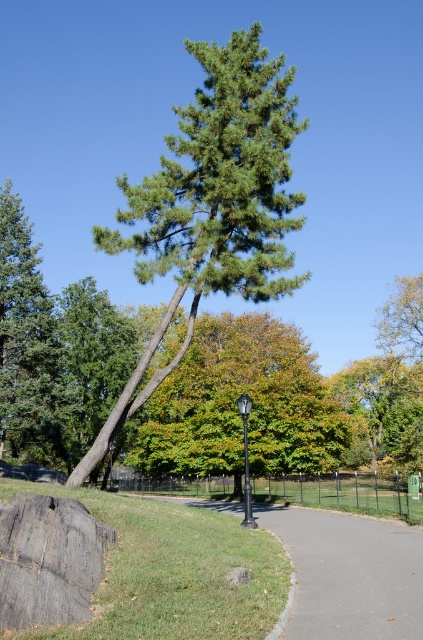
Is green needle-like tree at upper left further to the viewer compared to gray rough rock at lower left?

Yes, green needle-like tree at upper left is further from the viewer.

Does green needle-like tree at upper left have a greater width compared to gray rough rock at lower left?

Yes, green needle-like tree at upper left is wider than gray rough rock at lower left.

Which is behind, point (52, 312) or point (14, 586)?

The point (52, 312) is more distant.

Locate an element on the screen. The image size is (423, 640). green needle-like tree at upper left is located at coordinates (30, 346).

Who is taller, green needle-like at center or gray rough rock at lower left?

With more height is green needle-like at center.

Is green needle-like at center taller than gray rough rock at lower left?

Correct, green needle-like at center is much taller as gray rough rock at lower left.

Who is more forward, (167, 248) or (84, 588)?

Point (84, 588) is in front.

Identify the location of green needle-like at center. The height and width of the screenshot is (640, 423). tap(211, 202).

From the picture: Between green leafy tree at center and green needle-like tree at upper left, which one is positioned lower?

green leafy tree at center is below.

Where is `green leafy tree at center`? green leafy tree at center is located at coordinates (236, 404).

Locate an element on the screen. The height and width of the screenshot is (640, 423). green leafy tree at center is located at coordinates (236, 404).